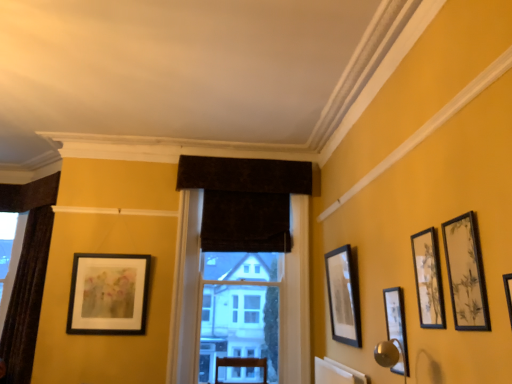
This screenshot has width=512, height=384. Describe the element at coordinates (108, 294) in the screenshot. I see `matte black picture frame at left, which is counted as the 5th picture frame, starting from the right` at that location.

Measure the distance between point [346,301] and camera.

Point [346,301] and camera are 3.47 meters apart from each other.

Describe the element at coordinates (343, 296) in the screenshot. I see `matte black picture frame at center right, positioned as the fourth picture frame in right-to-left order` at that location.

Where is `matte black picture frame at upper right, arranged as the second picture frame when viewed from the front`? This screenshot has height=384, width=512. matte black picture frame at upper right, arranged as the second picture frame when viewed from the front is located at coordinates (428, 279).

I want to click on velvet dark brown curtain at center, so click(239, 310).

Locate an element on the screen. matte black picture frame at upper right, the 5th picture frame positioned from the back is located at coordinates (466, 273).

Where is `dark velvet curtain at center`? Image resolution: width=512 pixels, height=384 pixels. dark velvet curtain at center is located at coordinates (245, 222).

Which object is thinner, matte black picture frame at upper right, arranged as the second picture frame when viewed from the front, or velvet dark brown curtain at center?

With smaller width is matte black picture frame at upper right, arranged as the second picture frame when viewed from the front.

Are matte black picture frame at upper right, which appears as the second picture frame when viewed from the right, and velvet dark brown curtain at center far apart?

Indeed, matte black picture frame at upper right, which appears as the second picture frame when viewed from the right, is not near velvet dark brown curtain at center.

From a real-world perspective, is matte black picture frame at upper right, arranged as the 4th picture frame when viewed from the back, beneath velvet dark brown curtain at center?

Yes, from a real-world perspective, matte black picture frame at upper right, arranged as the 4th picture frame when viewed from the back, is under velvet dark brown curtain at center.

I want to click on bay window behind the matte black picture frame at upper right, the 4th picture frame when ordered from left to right, so click(239, 310).

Based on the photo, is matte black picture frame at left, positioned as the first picture frame in left-to-right order, positioned with its back to dark brown velvet curtain at left, the first window in the back-to-front sequence?

No, matte black picture frame at left, positioned as the first picture frame in left-to-right order, is not facing the opposite direction of dark brown velvet curtain at left, the first window in the back-to-front sequence.

Which is behind, matte black picture frame at left, which is counted as the first picture frame, starting from the back, or dark brown velvet curtain at left, the 1th window in the left-to-right sequence?

dark brown velvet curtain at left, the 1th window in the left-to-right sequence, is further away from the camera.

Choose the correct answer: Is matte black picture frame at left, which is counted as the first picture frame, starting from the back, inside dark brown velvet curtain at left, the 1th window in the left-to-right sequence, or outside it?

matte black picture frame at left, which is counted as the first picture frame, starting from the back, is spatially situated outside dark brown velvet curtain at left, the 1th window in the left-to-right sequence.

From a real-world perspective, relative to dark brown velvet curtain at left, arranged as the 2th window when viewed from the right, is matte black picture frame at left, positioned as the first picture frame in left-to-right order, vertically above or below?

matte black picture frame at left, positioned as the first picture frame in left-to-right order, is situated lower than dark brown velvet curtain at left, arranged as the 2th window when viewed from the right, in the real world.

Who is more distant, dark brown velvet curtain at left, the 1th window in the left-to-right sequence, or dark velvet curtain at center?

dark brown velvet curtain at left, the 1th window in the left-to-right sequence, is further from the camera.

Are dark brown velvet curtain at left, the 1th window in the left-to-right sequence, and dark velvet curtain at center far apart?

Indeed, dark brown velvet curtain at left, the 1th window in the left-to-right sequence, is not near dark velvet curtain at center.

Identify the location of curtain above the dark brown velvet curtain at left, arranged as the 2th window when viewed from the right (from the image's perspective). The image size is (512, 384). (245, 222).

From the image's perspective, which is above, dark brown velvet curtain at left, placed as the 2th window when sorted from front to back, or dark velvet curtain at center?

dark velvet curtain at center.

Which of these two, velvet dark brown curtain at center or dark brown velvet curtain at left, the 1th window in the left-to-right sequence, stands taller?

Standing taller between the two is velvet dark brown curtain at center.

Does velvet dark brown curtain at center have a smaller size compared to dark brown velvet curtain at left, placed as the 2th window when sorted from front to back?

No.

Would you say velvet dark brown curtain at center is a long distance from dark brown velvet curtain at left, arranged as the 2th window when viewed from the right?

That's right, there is a large distance between velvet dark brown curtain at center and dark brown velvet curtain at left, arranged as the 2th window when viewed from the right.

Locate an element on the screen. the 2nd window positioned above the velvet dark brown curtain at center (from a real-world perspective) is located at coordinates (9, 256).

Would you say velvet dark brown curtain at center is to the left or to the right of matte black picture frame at center right, positioned as the fourth picture frame in right-to-left order, in the picture?

From the image, it's evident that velvet dark brown curtain at center is to the left of matte black picture frame at center right, positioned as the fourth picture frame in right-to-left order.

Based on the photo, is velvet dark brown curtain at center oriented towards matte black picture frame at center right, marked as the 2th picture frame in a back-to-front arrangement?

Yes, velvet dark brown curtain at center faces towards matte black picture frame at center right, marked as the 2th picture frame in a back-to-front arrangement.

Can you tell me how much velvet dark brown curtain at center and matte black picture frame at center right, which is the fourth picture frame from front to back, differ in facing direction?

The facing directions of velvet dark brown curtain at center and matte black picture frame at center right, which is the fourth picture frame from front to back, are 91.5 degrees apart.

From a real-world perspective, is velvet dark brown curtain at center on matte black picture frame at center right, which is the fourth picture frame from front to back?

Yes, from a real-world perspective, velvet dark brown curtain at center is on top of matte black picture frame at center right, which is the fourth picture frame from front to back.

From a real-world perspective, is matte black picture frame at center right, marked as the 2th picture frame in a back-to-front arrangement, below velvet dark brown curtain at center, positioned as the second window in back-to-front order?

Yes, from a real-world perspective, matte black picture frame at center right, marked as the 2th picture frame in a back-to-front arrangement, is beneath velvet dark brown curtain at center, positioned as the second window in back-to-front order.

From the image's perspective, which one is positioned lower, matte black picture frame at center right, which is the fourth picture frame from front to back, or velvet dark brown curtain at center, the 2th window viewed from the left?

From the image's view, velvet dark brown curtain at center, the 2th window viewed from the left, is below.

Does matte black picture frame at center right, which is the fourth picture frame from front to back, turn towards velvet dark brown curtain at center, the 2th window viewed from the left?

No, matte black picture frame at center right, which is the fourth picture frame from front to back, is not facing towards velvet dark brown curtain at center, the 2th window viewed from the left.

Which of these two, matte black picture frame at center right, marked as the 2th picture frame in a back-to-front arrangement, or velvet dark brown curtain at center, the 2th window viewed from the left, stands shorter?

matte black picture frame at center right, marked as the 2th picture frame in a back-to-front arrangement.

Is matte black picture frame at right, placed as the third picture frame when sorted from right to left, facing away from matte black picture frame at upper right, acting as the fifth picture frame starting from the left?

matte black picture frame at right, placed as the third picture frame when sorted from right to left, does not have its back to matte black picture frame at upper right, acting as the fifth picture frame starting from the left.

Between matte black picture frame at right, the third picture frame viewed from the back, and matte black picture frame at upper right, placed as the first picture frame when sorted from right to left, which one has less height?

Standing shorter between the two is matte black picture frame at upper right, placed as the first picture frame when sorted from right to left.

Is matte black picture frame at right, which is the third picture frame from front to back, next to matte black picture frame at upper right, acting as the fifth picture frame starting from the left?

They are not placed beside each other.

Is matte black picture frame at right, arranged as the third picture frame when viewed from the left, inside or outside of matte black picture frame at upper right, placed as the first picture frame when sorted from right to left?

matte black picture frame at right, arranged as the third picture frame when viewed from the left, is not inside matte black picture frame at upper right, placed as the first picture frame when sorted from right to left, it's outside.

The width and height of the screenshot is (512, 384). Find the location of `the 2nd picture frame positioned below the velvet dark brown curtain at center (from a real-world perspective)`. the 2nd picture frame positioned below the velvet dark brown curtain at center (from a real-world perspective) is located at coordinates (428, 279).

Image resolution: width=512 pixels, height=384 pixels. I want to click on picture frame that is the 1st one when counting rightward from the dark brown velvet curtain at left, arranged as the 2th window when viewed from the right, so click(108, 294).

Estimate the real-world distances between objects in this image. Which object is further from dark velvet curtain at center, velvet dark brown curtain at center or matte black picture frame at upper right, acting as the fifth picture frame starting from the left?

matte black picture frame at upper right, acting as the fifth picture frame starting from the left, is positioned further to the anchor dark velvet curtain at center.

Estimate the real-world distances between objects in this image. Which object is further from dark brown velvet curtain at left, arranged as the 2th window when viewed from the right, dark velvet curtain at center or matte black picture frame at upper right, which appears as the second picture frame when viewed from the right?

Among the two, matte black picture frame at upper right, which appears as the second picture frame when viewed from the right, is located further to dark brown velvet curtain at left, arranged as the 2th window when viewed from the right.

Considering their positions, is matte black picture frame at center right, positioned as the fourth picture frame in right-to-left order, positioned further to matte black picture frame at upper right, placed as the first picture frame when sorted from right to left, than matte black picture frame at left, which is counted as the first picture frame, starting from the back?

matte black picture frame at left, which is counted as the first picture frame, starting from the back, lies further to matte black picture frame at upper right, placed as the first picture frame when sorted from right to left, than the other object.

Looking at the image, which one is located closer to matte black picture frame at upper right, acting as the fifth picture frame starting from the left, velvet dark brown curtain at center, which is the 1th window from front to back, or dark brown velvet curtain at left, the 1th window in the left-to-right sequence?

Among the two, velvet dark brown curtain at center, which is the 1th window from front to back, is located nearer to matte black picture frame at upper right, acting as the fifth picture frame starting from the left.

Looking at the image, which one is located closer to matte black picture frame at center right, marked as the 2th picture frame in a back-to-front arrangement, dark velvet curtain at center or velvet dark brown curtain at center?

The object closer to matte black picture frame at center right, marked as the 2th picture frame in a back-to-front arrangement, is velvet dark brown curtain at center.

Which object lies further to the anchor point matte black picture frame at left, which ranks as the 5th picture frame in front-to-back order, matte black picture frame at center right, which is the fourth picture frame from front to back, or velvet dark brown curtain at center, which is the 1th window from front to back?

Among the two, matte black picture frame at center right, which is the fourth picture frame from front to back, is located further to matte black picture frame at left, which ranks as the 5th picture frame in front-to-back order.

Looking at the image, which one is located closer to matte black picture frame at upper right, arranged as the second picture frame when viewed from the front, velvet dark brown curtain at center or matte black picture frame at left, which is counted as the 5th picture frame, starting from the right?

The object closer to matte black picture frame at upper right, arranged as the second picture frame when viewed from the front, is velvet dark brown curtain at center.

Estimate the real-world distances between objects in this image. Which object is closer to matte black picture frame at left, which is counted as the first picture frame, starting from the back, matte black picture frame at center right, which is the fourth picture frame from front to back, or dark brown velvet curtain at left, the 1th window in the left-to-right sequence?

Based on the image, dark brown velvet curtain at left, the 1th window in the left-to-right sequence, appears to be nearer to matte black picture frame at left, which is counted as the first picture frame, starting from the back.

You are a GUI agent. You are given a task and a screenshot of the screen. Output one action in this format:
    pyautogui.click(x=<x>, y=<y>)
    Task: Click on the window located between matte black picture frame at left, which ranks as the 5th picture frame in front-to-back order, and matte black picture frame at right, placed as the third picture frame when sorted from right to left, in the left-right direction
    This screenshot has height=384, width=512.
    Given the screenshot: What is the action you would take?
    pyautogui.click(x=270, y=247)

Where is `window between dark brown velvet curtain at left, the 1th window in the left-to-right sequence, and velvet dark brown curtain at center from left to right`? window between dark brown velvet curtain at left, the 1th window in the left-to-right sequence, and velvet dark brown curtain at center from left to right is located at coordinates (270, 247).

Image resolution: width=512 pixels, height=384 pixels. I want to click on bay window situated between dark brown velvet curtain at left, placed as the 2th window when sorted from front to back, and matte black picture frame at right, placed as the third picture frame when sorted from right to left, from left to right, so click(x=239, y=310).

The height and width of the screenshot is (384, 512). In order to click on window that lies between dark velvet curtain at center and velvet dark brown curtain at center from top to bottom in this screenshot , I will do `click(270, 247)`.